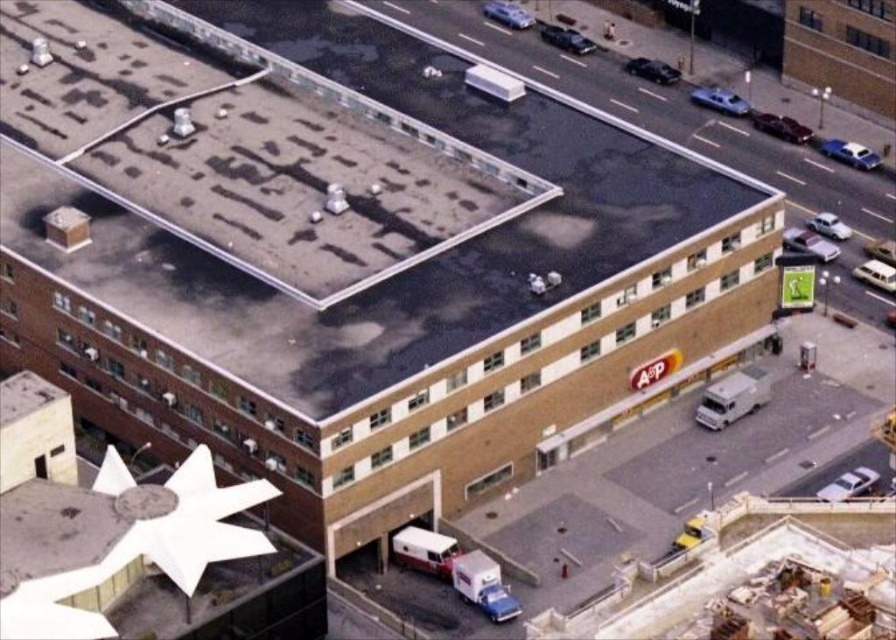
Question: Estimate the real-world distances between objects in this image. Which object is closer to the silver metallic sedan at upper right?

Choices:
 (A) shiny black sedan at upper right
 (B) white matte van at upper right
 (C) white matte car at upper right
 (D) metallic blue car at upper center

Answer: (A)

Question: Estimate the real-world distances between objects in this image. Which object is farther from the white matte van at upper right?

Choices:
 (A) silver metallic sedan at right
 (B) silver metallic sedan at lower right

Answer: (B)

Question: Is shiny blue sedan at right smaller than shiny black sedan at upper right?

Choices:
 (A) yes
 (B) no

Answer: (A)

Question: Can you confirm if silver metallic sedan at right is smaller than shiny black sedan at upper right?

Choices:
 (A) yes
 (B) no

Answer: (B)

Question: Where is shiny blue sedan at right located in relation to white matte car at upper right in the image?

Choices:
 (A) below
 (B) above

Answer: (B)

Question: Among these points, which one is nearest to the camera?

Choices:
 (A) (546, 38)
 (B) (530, 22)
 (C) (889, 280)
 (D) (829, 492)

Answer: (D)